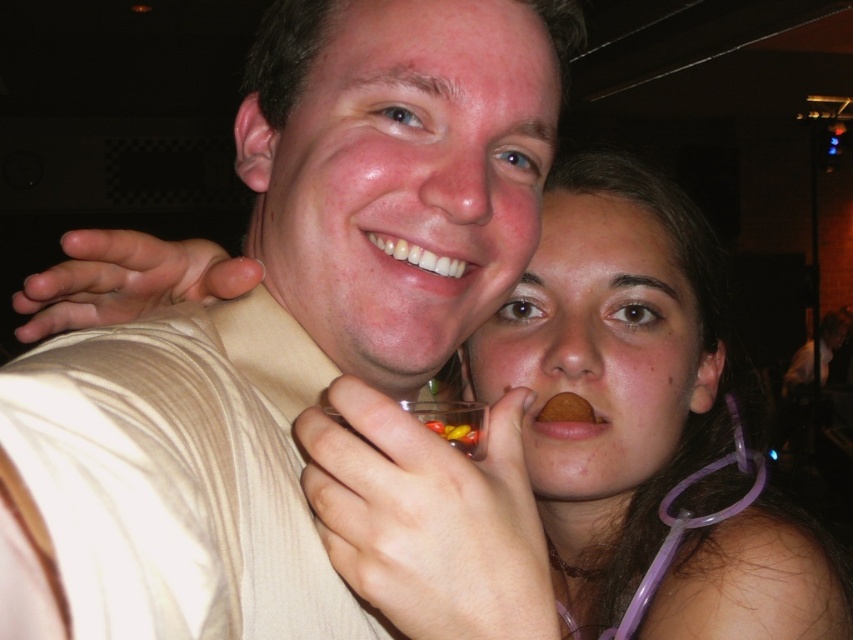
Question: Can you confirm if matte beige shirt at center is positioned to the left of brown matte cookie at mouth?

Choices:
 (A) yes
 (B) no

Answer: (A)

Question: Among these objects, which one is farthest from the camera?

Choices:
 (A) translucent plastic candy at mouth
 (B) smooth skin face at center
 (C) translucent plastic cup at center

Answer: (B)

Question: Does smooth skin face at center have a lesser width compared to brown matte cookie at mouth?

Choices:
 (A) no
 (B) yes

Answer: (A)

Question: Observing the image, what is the correct spatial positioning of matte beige shirt at center in reference to smooth skin face at center?

Choices:
 (A) left
 (B) right

Answer: (A)

Question: Which of the following is the closest to the observer?

Choices:
 (A) matte beige shirt at center
 (B) translucent plastic candy at mouth
 (C) smooth skin face at center

Answer: (A)

Question: Which object appears closest to the camera in this image?

Choices:
 (A) translucent plastic candy at mouth
 (B) translucent plastic cup at center
 (C) smooth skin face at center
 (D) matte beige shirt at center

Answer: (D)